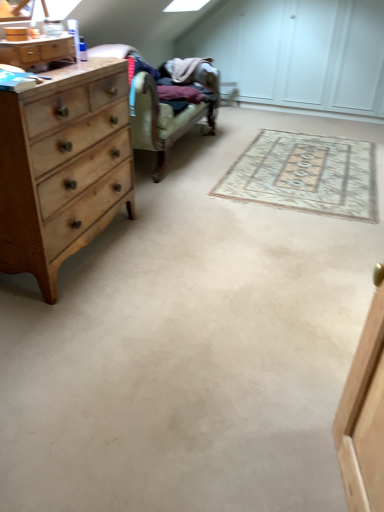
This screenshot has width=384, height=512. What do you see at coordinates (37, 51) in the screenshot?
I see `wooden dresser at left` at bounding box center [37, 51].

Where is `beige woven rug at center`? This screenshot has width=384, height=512. beige woven rug at center is located at coordinates (305, 174).

I want to click on mat above the light brown wood chest of drawers at left (from the image's perspective), so click(x=305, y=174).

Considering the sizes of objects light brown wood chest of drawers at left and beige woven rug at center in the image provided, who is bigger, light brown wood chest of drawers at left or beige woven rug at center?

With larger size is light brown wood chest of drawers at left.

Between light brown wood chest of drawers at left and beige woven rug at center, which one has less height?

Standing shorter between the two is beige woven rug at center.

Between light brown wood chest of drawers at left and beige woven rug at center, which one appears on the right side from the viewer's perspective?

Positioned to the right is beige woven rug at center.

Locate an element on the screen. cabinetry located above the beige woven rug at center (from the image's perspective) is located at coordinates (37, 51).

Is point (6, 46) positioned behind point (218, 195)?

No, it is in front of (218, 195).

Is wooden dresser at left not inside beige woven rug at center?

wooden dresser at left is positioned outside beige woven rug at center.

Is wooden dresser at left turned away from light brown wood chest of drawers at left?

wooden dresser at left is not turned away from light brown wood chest of drawers at left.

Considering the sizes of objects wooden dresser at left and light brown wood chest of drawers at left in the image provided, who is wider, wooden dresser at left or light brown wood chest of drawers at left?

With larger width is light brown wood chest of drawers at left.

Is wooden dresser at left to the left of light brown wood chest of drawers at left from the viewer's perspective?

No, wooden dresser at left is not to the left of light brown wood chest of drawers at left.

Can you confirm if light brown wood chest of drawers at left is positioned to the right of wooden dresser at left?

Incorrect, light brown wood chest of drawers at left is not on the right side of wooden dresser at left.

From a real-world perspective, does light brown wood chest of drawers at left sit lower than wooden dresser at left?

Yes, from a real-world perspective, light brown wood chest of drawers at left is under wooden dresser at left.

Is wooden dresser at left completely or partially inside light brown wood chest of drawers at left?

That's incorrect, wooden dresser at left is not inside light brown wood chest of drawers at left.

Would you say beige woven rug at center is a long distance from wooden dresser at left?

Yes.

Does beige woven rug at center turn towards wooden dresser at left?

No, beige woven rug at center is not facing towards wooden dresser at left.

Who is bigger, beige woven rug at center or wooden dresser at left?

With larger size is beige woven rug at center.

Does beige woven rug at center lie in front of wooden dresser at left?

No, beige woven rug at center is further to the viewer.

Considering the sizes of beige woven rug at center and light brown wood chest of drawers at left in the image, is beige woven rug at center wider or thinner than light brown wood chest of drawers at left?

Clearly, beige woven rug at center has more width compared to light brown wood chest of drawers at left.

Is light brown wood chest of drawers at left a part of beige woven rug at center?

That's incorrect, light brown wood chest of drawers at left is not inside beige woven rug at center.

Relative to light brown wood chest of drawers at left, is beige woven rug at center in front or behind?

In the image, beige woven rug at center appears behind light brown wood chest of drawers at left.

Consider the image. Considering the sizes of beige woven rug at center and light brown wood chest of drawers at left in the image, is beige woven rug at center bigger or smaller than light brown wood chest of drawers at left?

Clearly, beige woven rug at center is smaller in size than light brown wood chest of drawers at left.

This screenshot has height=512, width=384. Identify the location of mat on the right of light brown wood chest of drawers at left. pos(305,174).

Locate an element on the screen. Image resolution: width=384 pixels, height=512 pixels. cabinetry that appears above the beige woven rug at center (from a real-world perspective) is located at coordinates (37, 51).

Based on the photo, when comparing their distances from light brown wood chest of drawers at left, does beige woven rug at center or wooden dresser at left seem closer?

wooden dresser at left.

Looking at the image, which one is located further to beige woven rug at center, wooden dresser at left or light brown wood chest of drawers at left?

wooden dresser at left lies further to beige woven rug at center than the other object.

In the scene shown: Which object lies nearer to the anchor point light brown wood chest of drawers at left, wooden dresser at left or beige woven rug at center?

wooden dresser at left lies closer to light brown wood chest of drawers at left than the other object.

From the image, which object appears to be nearer to wooden dresser at left, light brown wood chest of drawers at left or beige woven rug at center?

Based on the image, light brown wood chest of drawers at left appears to be nearer to wooden dresser at left.

When comparing their distances from beige woven rug at center, does light brown wood chest of drawers at left or wooden dresser at left seem closer?

light brown wood chest of drawers at left is positioned closer to the anchor beige woven rug at center.

From the image, which object appears to be nearer to wooden dresser at left, beige woven rug at center or light brown wood chest of drawers at left?

light brown wood chest of drawers at left lies closer to wooden dresser at left than the other object.

The image size is (384, 512). In order to click on cabinetry between light brown wood chest of drawers at left and beige woven rug at center in the horizontal direction in this screenshot , I will do `click(37, 51)`.